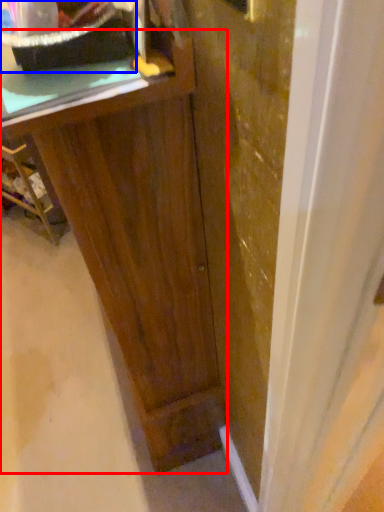
Question: Which object is closer to the camera taking this photo, vanity (highlighted by a red box) or appliance (highlighted by a blue box)?

Choices:
 (A) vanity
 (B) appliance

Answer: (B)